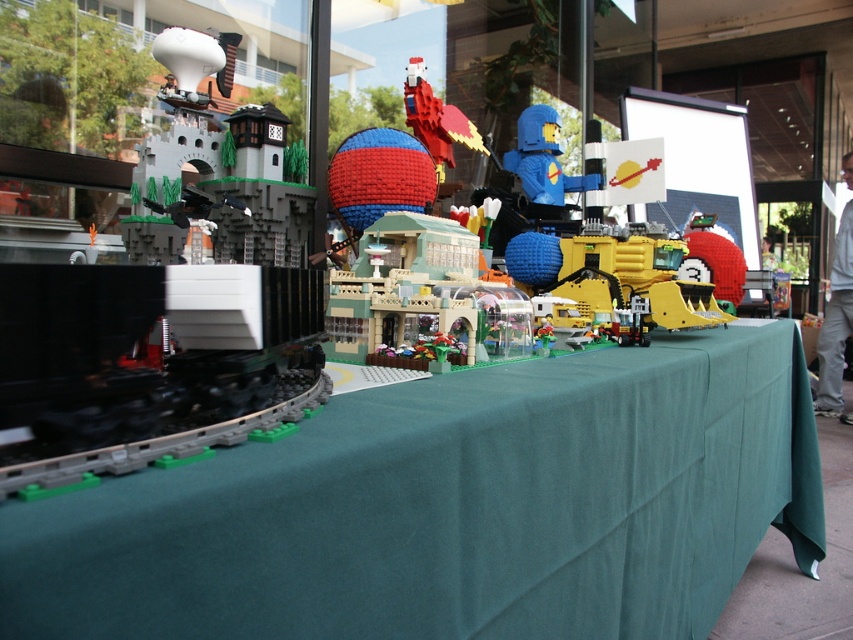
Question: Can you confirm if blue matte figure at center is smaller than brick-like parrot at center?

Choices:
 (A) no
 (B) yes

Answer: (A)

Question: Which point is farther to the camera?

Choices:
 (A) blue matte figure at center
 (B) brick-like parrot at center
 (C) green fabric table at center

Answer: (A)

Question: Considering the relative positions of green fabric table at center and brick-like parrot at center in the image provided, where is green fabric table at center located with respect to brick-like parrot at center?

Choices:
 (A) above
 (B) below

Answer: (B)

Question: Among these points, which one is nearest to the camera?

Choices:
 (A) (445, 138)
 (B) (550, 193)
 (C) (801, 464)

Answer: (A)

Question: Which of the following is the farthest from the observer?

Choices:
 (A) green fabric table at center
 (B) brick-like parrot at center

Answer: (B)

Question: Can you confirm if green fabric table at center is wider than blue matte figure at center?

Choices:
 (A) yes
 (B) no

Answer: (A)